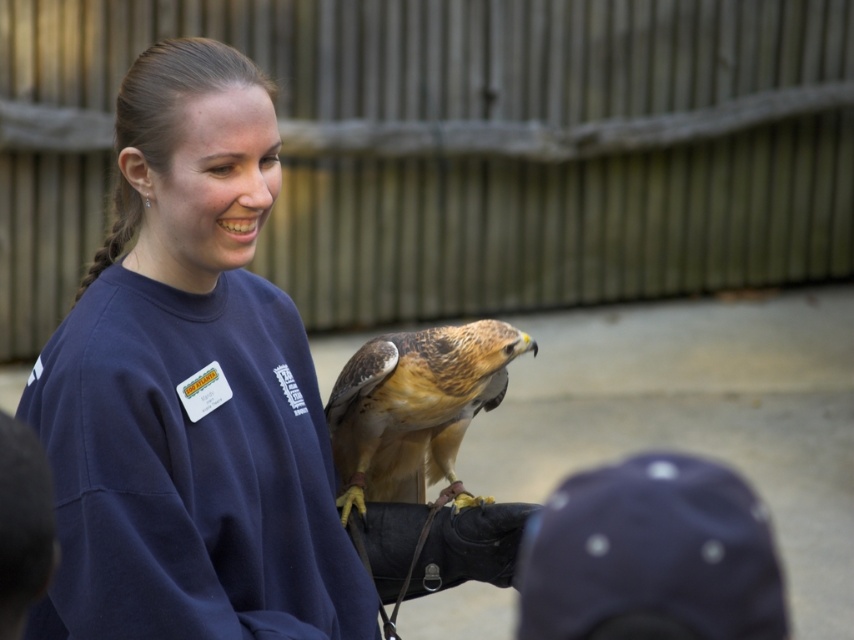
You are a costume designer preparing for a play about wildlife educators. You need to ensure that the costume and prop sizes are proportional. Given the scene described, which object is wider, the navy blue sweatshirt at center or the brown feathered falcon at center?

The navy blue sweatshirt at center is wider than the brown feathered falcon at center according to the description.

You are a visitor at the sanctuary and want to take a photo of the brown feathered falcon at center without the navy blue sweatshirt at center blocking the view. Is there a way to adjust your position to see the falcon clearly?

The navy blue sweatshirt at center is positioned over the brown feathered falcon at center, so moving to a lower angle or shifting sideways might allow you to see the falcon without obstruction.